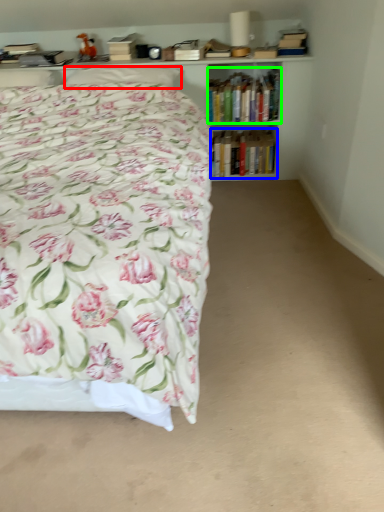
Question: Which object is the closest to the pillow (highlighted by a red box)? Choose among these: book (highlighted by a blue box) or book (highlighted by a green box).

Choices:
 (A) book
 (B) book

Answer: (B)